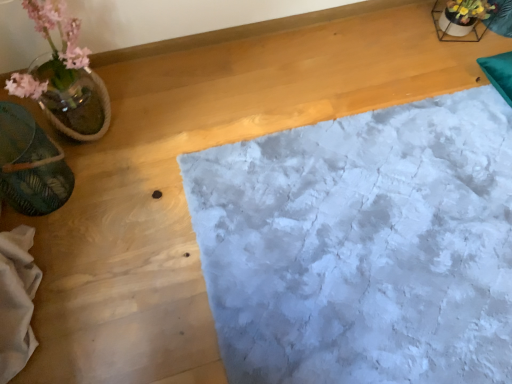
Where is `empty space that is in between translucent glass vase at left and white textured rug at center`? This screenshot has height=384, width=512. empty space that is in between translucent glass vase at left and white textured rug at center is located at coordinates (195, 152).